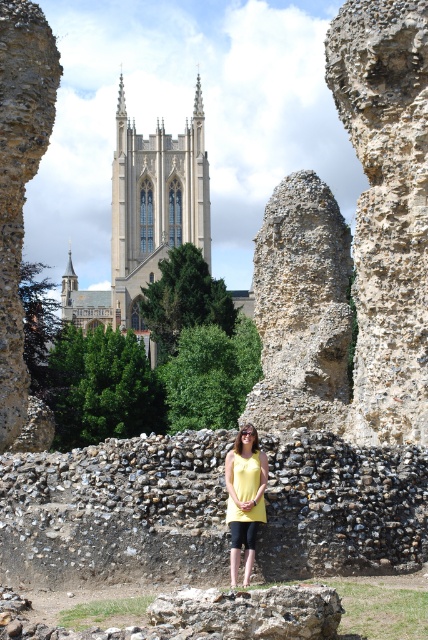
You are standing at the base of the ancient stone ruins and want to take a photo of the light beige stone church at upper center. Which direction should you face to ensure the church is in the frame?

You should face towards the upper center direction to capture the light beige stone church at upper center in your photo.

You are a photographer trying to capture the light beige stone church at upper center in your shot. However, the yellow fabric top at center is blocking your view. Can you adjust your position to see the church without moving the person? Explain why or why not based on their positions.

The light beige stone church at upper center is positioned above the yellow fabric top at center, so by tilting the camera upwards or moving your position to a higher angle, you can capture the church without moving the person.

You are standing at the point marked as point (145, 218) in the image. What structure are you currently on?

You are standing on the light beige stone church at upper center.